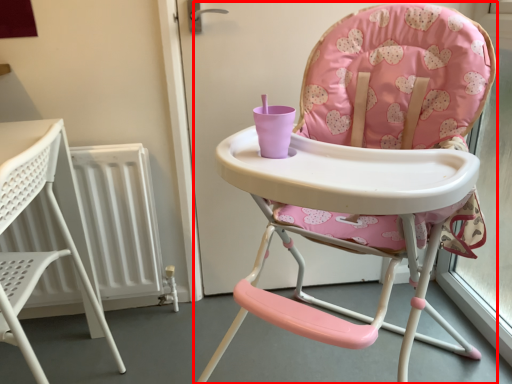
Question: Observing the image, what is the correct spatial positioning of chair (annotated by the red box) in reference to chair?

Choices:
 (A) left
 (B) right

Answer: (B)